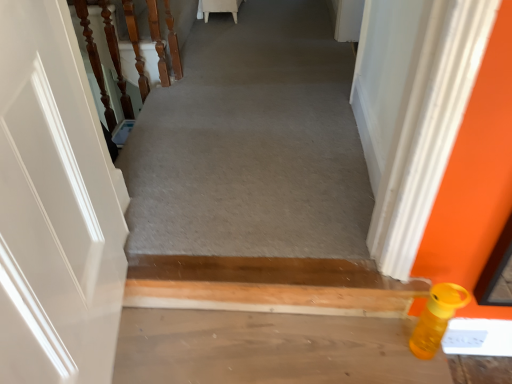
Measure the distance between smooth concrete floor at lower right and camera.

The depth of smooth concrete floor at lower right is 1.15 meters.

Locate an element on the screen. This screenshot has width=512, height=384. wooden balusters at left is located at coordinates (94, 58).

Measure the distance between point (436, 320) and camera.

Point (436, 320) is 1.10 meters from camera.

I want to click on smooth concrete floor at lower right, so (x=267, y=349).

Is wooden balusters at left oriented towards yellow matte bottle at lower right?

No, wooden balusters at left is not aimed at yellow matte bottle at lower right.

Between wooden balusters at left and yellow matte bottle at lower right, which one appears on the left side from the viewer's perspective?

wooden balusters at left.

From the picture: Considering the relative sizes of wooden balusters at left and yellow matte bottle at lower right in the image provided, is wooden balusters at left shorter than yellow matte bottle at lower right?

No, wooden balusters at left is not shorter than yellow matte bottle at lower right.

Can you confirm if wooden balusters at left is thinner than yellow matte bottle at lower right?

In fact, wooden balusters at left might be wider than yellow matte bottle at lower right.

From the picture: Does matte plastic bottle at lower right lie in front of smooth concrete floor at lower right?

No.

Would you say matte plastic bottle at lower right is inside or outside smooth concrete floor at lower right?

matte plastic bottle at lower right is outside smooth concrete floor at lower right.

Is matte plastic bottle at lower right touching smooth concrete floor at lower right?

No, matte plastic bottle at lower right is not making contact with smooth concrete floor at lower right.

The image size is (512, 384). Identify the location of stairwell above the matte plastic bottle at lower right (from the image's perspective). (94, 58).

Could you tell me if matte plastic bottle at lower right is turned towards wooden balusters at left?

No, matte plastic bottle at lower right does not turn towards wooden balusters at left.

Considering their positions, is matte plastic bottle at lower right located in front of or behind wooden balusters at left?

Visually, matte plastic bottle at lower right is located in front of wooden balusters at left.

From the image's perspective, would you say smooth concrete floor at lower right is positioned over matte plastic bottle at lower right?

No, from the image's perspective, smooth concrete floor at lower right is not over matte plastic bottle at lower right.

Is smooth concrete floor at lower right closer to camera compared to matte plastic bottle at lower right?

Yes, it is in front of matte plastic bottle at lower right.

Considering the relative sizes of smooth concrete floor at lower right and matte plastic bottle at lower right in the image provided, is smooth concrete floor at lower right taller than matte plastic bottle at lower right?

Yes.

From the picture: Is matte plastic bottle at lower right in front of yellow matte bottle at lower right?

That is False.

Considering the sizes of objects matte plastic bottle at lower right and yellow matte bottle at lower right in the image provided, who is bigger, matte plastic bottle at lower right or yellow matte bottle at lower right?

matte plastic bottle at lower right.

Does matte plastic bottle at lower right touch yellow matte bottle at lower right?

No, matte plastic bottle at lower right is not touching yellow matte bottle at lower right.

From the picture: Is yellow matte bottle at lower right taller or shorter than matte plastic bottle at lower right?

Clearly, yellow matte bottle at lower right is taller compared to matte plastic bottle at lower right.

Can you confirm if yellow matte bottle at lower right is bigger than matte plastic bottle at lower right?

Incorrect, yellow matte bottle at lower right is not larger than matte plastic bottle at lower right.

Considering the relative positions of yellow matte bottle at lower right and matte plastic bottle at lower right in the image provided, is yellow matte bottle at lower right to the right of matte plastic bottle at lower right from the viewer's perspective?

Indeed, yellow matte bottle at lower right is positioned on the right side of matte plastic bottle at lower right.

Which object is closer to the camera taking this photo, yellow matte bottle at lower right or matte plastic bottle at lower right?

Positioned in front is yellow matte bottle at lower right.

Between wooden balusters at left and smooth concrete floor at lower right, which one appears on the right side from the viewer's perspective?

Positioned to the right is smooth concrete floor at lower right.

Is point (97, 72) behind point (316, 348)?

That is True.

Is wooden balusters at left positioned in front of smooth concrete floor at lower right?

No.

In the scene shown: How different are the orientations of wooden balusters at left and smooth concrete floor at lower right in degrees?

wooden balusters at left and smooth concrete floor at lower right are facing 0.432 degrees away from each other.

What are the coordinates of `stairwell above the yellow matte bottle at lower right (from the image's perspective)` in the screenshot? It's located at (94, 58).

This screenshot has height=384, width=512. I want to click on passage behind the smooth concrete floor at lower right, so click(x=252, y=143).

Considering their positions, is wooden balusters at left positioned further to yellow matte bottle at lower right than matte plastic bottle at lower right?

The object further to yellow matte bottle at lower right is wooden balusters at left.

Which object lies further to the anchor point yellow matte bottle at lower right, smooth concrete floor at lower right or wooden balusters at left?

wooden balusters at left is positioned further to the anchor yellow matte bottle at lower right.

When comparing their distances from yellow matte bottle at lower right, does smooth concrete floor at lower right or matte plastic bottle at lower right seem further?

matte plastic bottle at lower right is further to yellow matte bottle at lower right.

Looking at the image, which one is located closer to wooden balusters at left, yellow matte bottle at lower right or smooth concrete floor at lower right?

Among the two, smooth concrete floor at lower right is located nearer to wooden balusters at left.

From the image, which object appears to be nearer to smooth concrete floor at lower right, yellow matte bottle at lower right or wooden balusters at left?

Based on the image, yellow matte bottle at lower right appears to be nearer to smooth concrete floor at lower right.

Considering their positions, is matte plastic bottle at lower right positioned further to smooth concrete floor at lower right than yellow matte bottle at lower right?

matte plastic bottle at lower right is positioned further to the anchor smooth concrete floor at lower right.

Looking at the image, which one is located closer to smooth concrete floor at lower right, matte plastic bottle at lower right or wooden balusters at left?

matte plastic bottle at lower right.

Considering their positions, is matte plastic bottle at lower right positioned closer to yellow matte bottle at lower right than smooth concrete floor at lower right?

smooth concrete floor at lower right is positioned closer to the anchor yellow matte bottle at lower right.

This screenshot has width=512, height=384. Identify the location of passage between wooden balusters at left and yellow matte bottle at lower right from left to right. (252, 143).

Locate an element on the screen. The height and width of the screenshot is (384, 512). bottle that lies between wooden balusters at left and smooth concrete floor at lower right from top to bottom is located at coordinates (436, 318).

Locate an element on the screen. bottle between matte plastic bottle at lower right and smooth concrete floor at lower right in the vertical direction is located at coordinates (436, 318).

Where is `passage that lies between wooden balusters at left and smooth concrete floor at lower right from top to bottom`? The width and height of the screenshot is (512, 384). passage that lies between wooden balusters at left and smooth concrete floor at lower right from top to bottom is located at coordinates (252, 143).